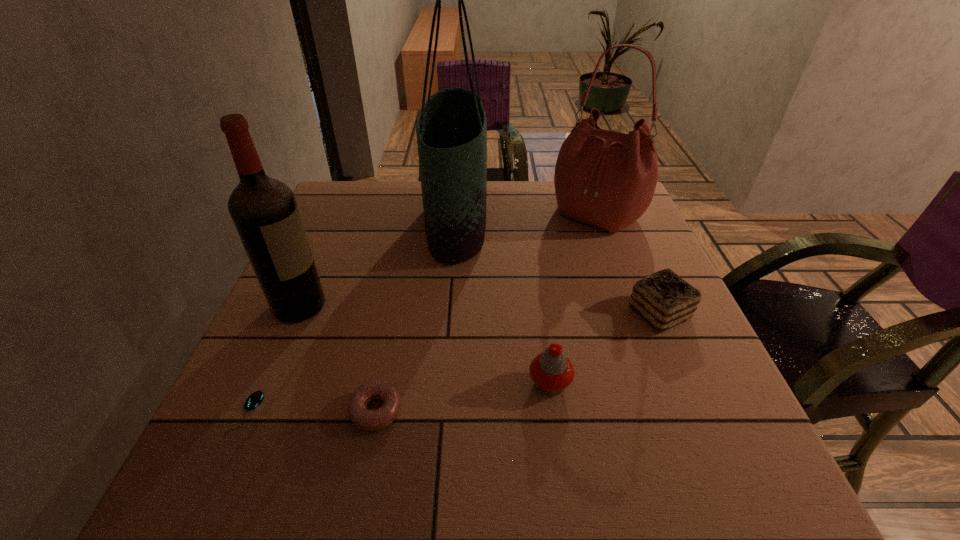
Where is `blank space located on the right of the third object from right to left`? The height and width of the screenshot is (540, 960). blank space located on the right of the third object from right to left is located at coordinates (715, 384).

At what (x,y) coordinates should I click in order to perform the action: click on free space located 0.350m on the left of the fifth tallest object. Please return your answer as a coordinate pair (x, y). Looking at the image, I should click on (463, 313).

This screenshot has height=540, width=960. What are the coordinates of `free space located on the back of the sixth tallest object` in the screenshot? It's located at (388, 353).

The image size is (960, 540). I want to click on vacant space located 0.280m on the back of the mouse, so click(303, 286).

The width and height of the screenshot is (960, 540). Find the location of `tote bag that is at the far edge`. tote bag that is at the far edge is located at coordinates (451, 128).

Image resolution: width=960 pixels, height=540 pixels. Find the location of `handbag positioned at the far edge`. handbag positioned at the far edge is located at coordinates (607, 179).

Where is `liquor located at the left edge`? liquor located at the left edge is located at coordinates (264, 210).

Where is `mouse that is at the left edge`? This screenshot has height=540, width=960. mouse that is at the left edge is located at coordinates (255, 399).

Locate an element on the screen. handbag that is at the right edge is located at coordinates (607, 179).

Find the location of `chocolate cake positioned at the right edge`. chocolate cake positioned at the right edge is located at coordinates 664,299.